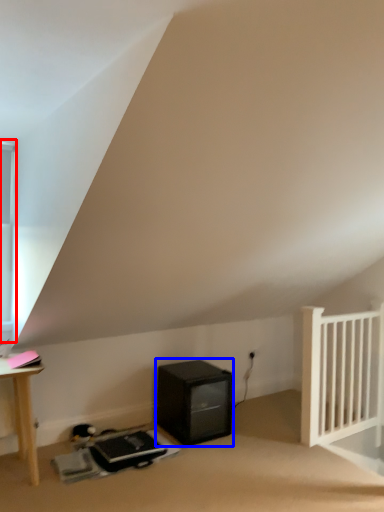
Question: Which point is further to the camera, window (highlighted by a red box) or appliance (highlighted by a blue box)?

Choices:
 (A) window
 (B) appliance

Answer: (B)